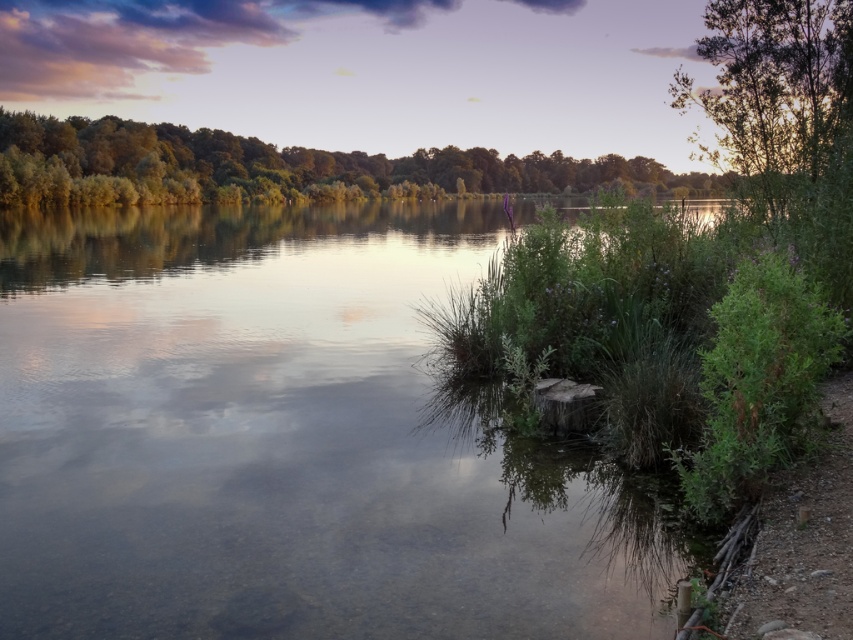
You are an artist trying to paint the lakeside scene. You notice the green leafy trees at upper left and the green leafy tree at upper right. Which tree should you paint larger to accurately represent their sizes in the image?

You should paint the green leafy trees at upper left larger than the green leafy tree at upper right because the green leafy trees at upper left has a larger size compared to green leafy tree at upper right.

You are standing at the lakeside and want to take a photo of the green leafy trees at upper left and the clear water at center. Which object should you focus on first if you want to capture both in one frame?

You should focus on the green leafy trees at upper left first because the clear water at center is to the left of them, so adjusting the camera to include both would require framing from the trees towards the water.

You are standing at the center of the lakeside and want to take a photo of the green leafy trees at upper left. In which direction should you point your camera to capture them?

The green leafy trees at upper left are located at point coordinates, so you should point your camera towards the upper left direction to capture them.